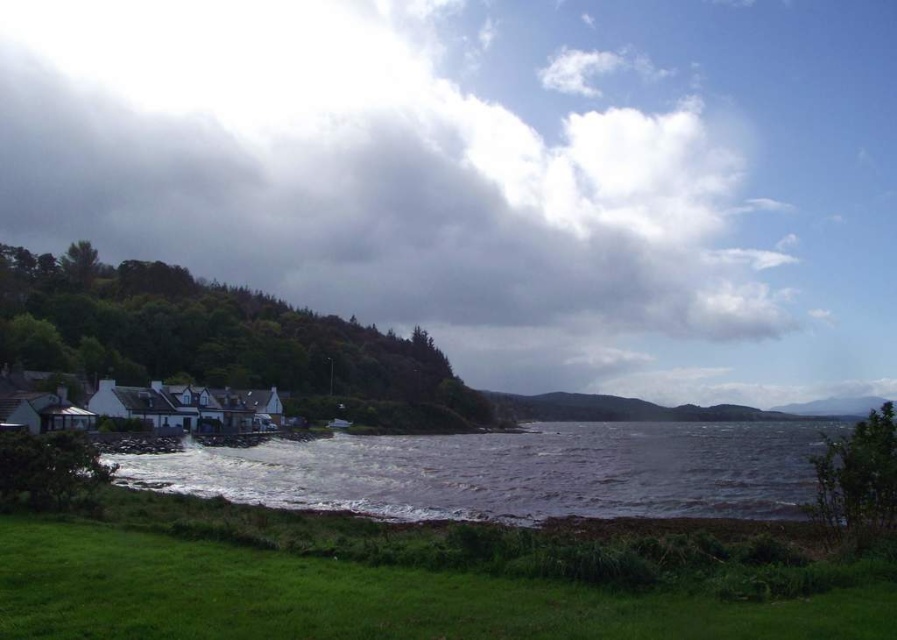
You are standing at the point closer to you between point [401,248] and point [810,472]. From your current position, which direction should you walk to reach the farther point?

You should walk towards point [810,472] because it is farther away from you than point [401,248].